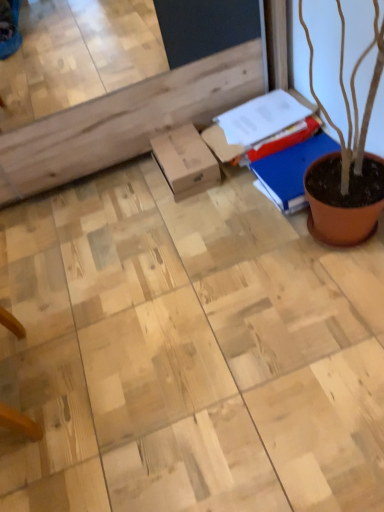
At what (x,y) coordinates should I click in order to perform the action: click on blue matte book at upper right. Please return your answer as a coordinate pair (x, y). Image resolution: width=384 pixels, height=512 pixels. Looking at the image, I should click on (289, 161).

This screenshot has height=512, width=384. What are the coordinates of `blue matte notebook at right` in the screenshot? It's located at (291, 170).

Where is `blue matte book at upper right`? The height and width of the screenshot is (512, 384). blue matte book at upper right is located at coordinates (289, 161).

Is cardboard box at center facing away from blue matte notebook at right?

That's not correct — cardboard box at center is not looking away from blue matte notebook at right.

Is point (179, 179) closer or farther from the camera than point (279, 170)?

Clearly, point (179, 179) is more distant from the camera than point (279, 170).

From the image's perspective, is cardboard box at center under blue matte notebook at right?

Incorrect, from the image's perspective, cardboard box at center is higher than blue matte notebook at right.

Considering the relative positions of cardboard box at center and blue matte notebook at right in the image provided, is cardboard box at center in front of blue matte notebook at right?

No, cardboard box at center is behind blue matte notebook at right.

Which of these two, blue matte book at upper right or cardboard box at center, is wider?

blue matte book at upper right is wider.

From the image's perspective, is blue matte book at upper right over cardboard box at center?

Yes, from the image's perspective, blue matte book at upper right is above cardboard box at center.

Is blue matte book at upper right positioned with its back to cardboard box at center?

No, blue matte book at upper right is not facing away from cardboard box at center.

Would you consider blue matte book at upper right to be distant from cardboard box at center?

That's not correct — blue matte book at upper right is a little close to cardboard box at center.

Looking at this image, from the image's perspective, relative to blue matte book at upper right, is blue matte notebook at right above or below?

Based on their image positions, blue matte notebook at right is located beneath blue matte book at upper right.

You are a GUI agent. You are given a task and a screenshot of the screen. Output one action in this format:
    pyautogui.click(x=<x>, y=<y>)
    Task: Click on the notebook that appears in front of the blue matte book at upper right
    The image size is (384, 512).
    Given the screenshot: What is the action you would take?
    pyautogui.click(x=291, y=170)

Is blue matte notebook at right at the right side of blue matte book at upper right?

Indeed, blue matte notebook at right is positioned on the right side of blue matte book at upper right.

Could you tell me if blue matte notebook at right is facing blue matte book at upper right?

No, blue matte notebook at right is not aimed at blue matte book at upper right.

From the image's perspective, relative to blue matte notebook at right, is blue matte book at upper right above or below?

blue matte book at upper right is situated higher than blue matte notebook at right in the image.

Which of these two, blue matte book at upper right or blue matte notebook at right, is bigger?

blue matte book at upper right is bigger.

Is blue matte book at upper right positioned with its back to blue matte notebook at right?

No, blue matte book at upper right's orientation is not away from blue matte notebook at right.

Looking at this image, what's the angular difference between blue matte book at upper right and blue matte notebook at right's facing directions?

0.00027 degrees separate the facing orientations of blue matte book at upper right and blue matte notebook at right.

Which object is further away from the camera taking this photo, blue matte notebook at right or cardboard box at center?

cardboard box at center is more distant.

In the image, there is a cardboard box at center. Where is `notebook below it (from the image's perspective)`? The image size is (384, 512). notebook below it (from the image's perspective) is located at coordinates (291, 170).

Does point (288, 157) appear closer or farther from the camera than point (160, 154)?

Point (288, 157).

Based on the photo, is blue matte notebook at right bigger or smaller than cardboard box at center?

In the image, blue matte notebook at right appears to be larger than cardboard box at center.

Looking at this image, can you confirm if cardboard box at center is thinner than blue matte book at upper right?

Indeed, cardboard box at center has a lesser width compared to blue matte book at upper right.

From the image's perspective, relative to blue matte book at upper right, is cardboard box at center above or below?

Based on their image positions, cardboard box at center is located beneath blue matte book at upper right.

Between cardboard box at center and blue matte book at upper right, which one is positioned behind?

cardboard box at center.

Image resolution: width=384 pixels, height=512 pixels. Identify the location of notebook that appears on the right of cardboard box at center. 291,170.

Find the location of `cardboard box located underneath the blue matte book at upper right (from a real-world perspective)`. cardboard box located underneath the blue matte book at upper right (from a real-world perspective) is located at coordinates (185, 161).

In the scene shown: From the image, which object appears to be nearer to blue matte book at upper right, blue matte notebook at right or cardboard box at center?

Based on the image, blue matte notebook at right appears to be nearer to blue matte book at upper right.

Looking at the image, which one is located further to blue matte notebook at right, blue matte book at upper right or cardboard box at center?

Among the two, cardboard box at center is located further to blue matte notebook at right.

Estimate the real-world distances between objects in this image. Which object is closer to blue matte book at upper right, cardboard box at center or blue matte notebook at right?

The object closer to blue matte book at upper right is blue matte notebook at right.

From the image, which object appears to be nearer to cardboard box at center, blue matte notebook at right or blue matte book at upper right?

blue matte book at upper right.

From the image, which object appears to be nearer to cardboard box at center, blue matte book at upper right or blue matte notebook at right?

blue matte book at upper right.

Consider the image. Considering their positions, is cardboard box at center positioned further to blue matte notebook at right than blue matte book at upper right?

cardboard box at center lies further to blue matte notebook at right than the other object.

This screenshot has width=384, height=512. What are the coordinates of `book located between cardboard box at center and blue matte notebook at right in the left-right direction` in the screenshot? It's located at (289, 161).